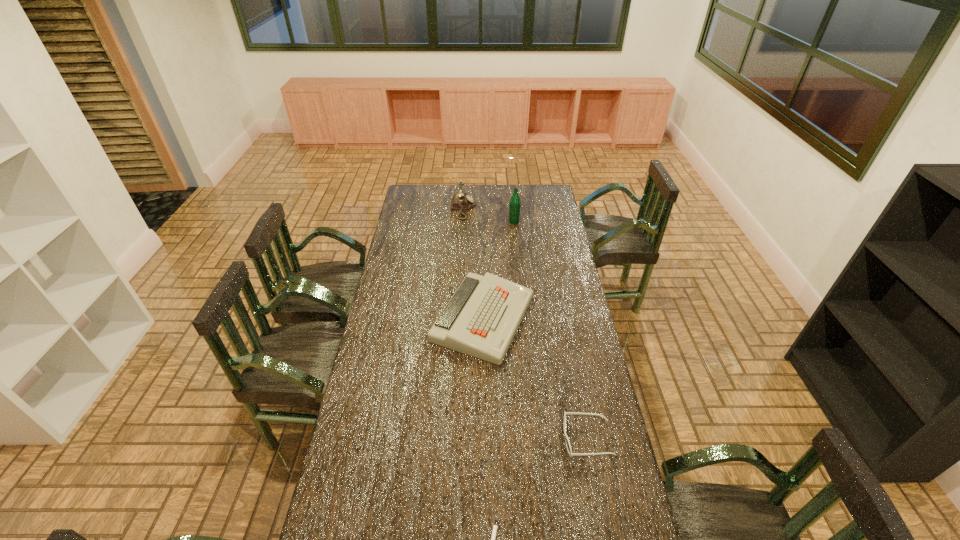
At what (x,y) coordinates should I click in order to perform the action: click on free space that is in between the computer keyboard and the fourth tallest object. Please return your answer as a coordinate pair (x, y). This screenshot has height=540, width=960. Looking at the image, I should click on (536, 378).

I want to click on vacant space that's between the third farthest object and the fourth tallest object, so click(536, 378).

You are a GUI agent. You are given a task and a screenshot of the screen. Output one action in this format:
    pyautogui.click(x=<x>, y=<y>)
    Task: Click on the free space between the tallest object and the telephone
    This screenshot has width=960, height=540.
    Given the screenshot: What is the action you would take?
    pos(489,215)

Image resolution: width=960 pixels, height=540 pixels. Identify the location of the fourth closest object to the tennis racket. (460, 201).

Image resolution: width=960 pixels, height=540 pixels. I want to click on object that is the third closest to the second shortest object, so click(515, 203).

The height and width of the screenshot is (540, 960). In order to click on vacant point that satisfies the following two spatial constraints: 1. on the dial of the bottle; 2. on the left side of the second tallest object in this screenshot , I will do tap(463, 221).

Identify the location of free space that satisfies the following two spatial constraints: 1. on the dial of the bottle; 2. on the right side of the telephone. Image resolution: width=960 pixels, height=540 pixels. (463, 221).

The image size is (960, 540). In order to click on vacant position in the image that satisfies the following two spatial constraints: 1. on the dial of the telephone; 2. on the right side of the bottle in this screenshot , I will do tap(463, 221).